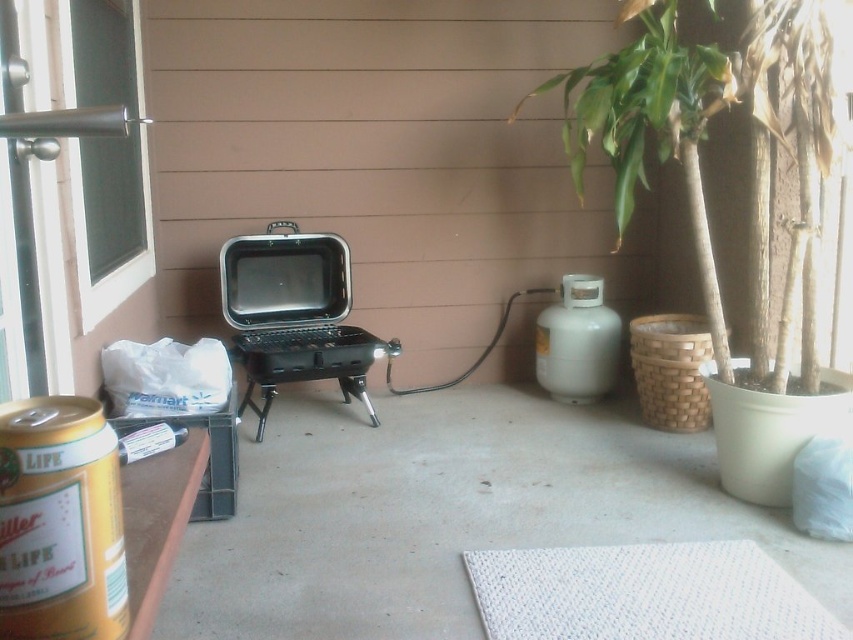
You are planning to rearrange the items on the patio. If you want to move the black matte barbecue grill at center closer to the clear glass screen door at upper left, will there be enough space between them considering their sizes?

The black matte barbecue grill at center occupies less space than the clear glass screen door at upper left, so moving it closer should be possible as the grill is smaller and the door is larger, providing sufficient space between them.